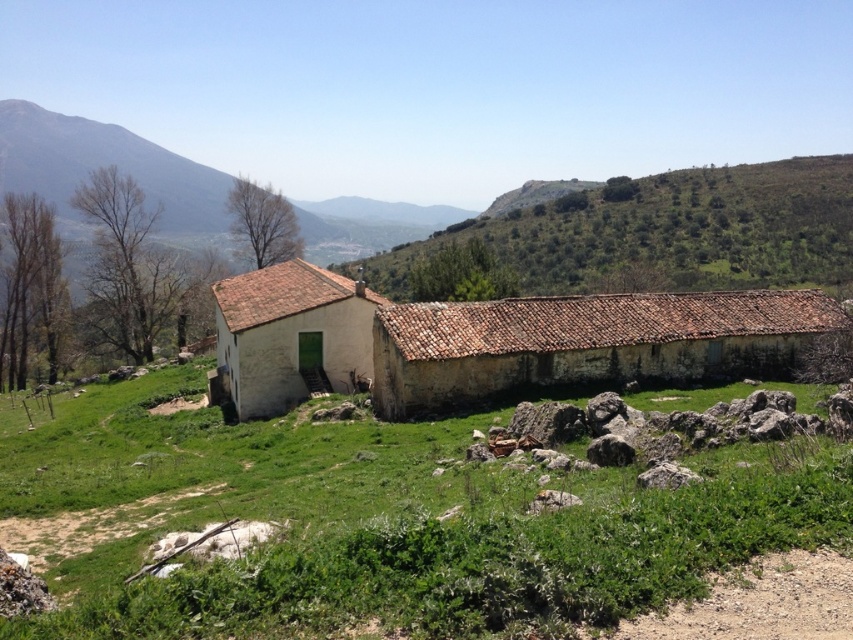
Is white clay barn at center below white matte house at center?

Yes, white clay barn at center is below white matte house at center.

Between white clay barn at center and white matte house at center, which one appears on the right side from the viewer's perspective?

From the viewer's perspective, white clay barn at center appears more on the right side.

Is point (397, 416) more distant than point (312, 339)?

No, it is in front of (312, 339).

Where is `white clay barn at center`? The height and width of the screenshot is (640, 853). white clay barn at center is located at coordinates (489, 339).

Is green grassy at center below white matte house at center?

Yes.

Where is `green grassy at center`? The image size is (853, 640). green grassy at center is located at coordinates (450, 538).

Is point (672, 554) positioned after point (247, 291)?

No, it is not.

Where is `green grassy at center`? green grassy at center is located at coordinates (450, 538).

Can you confirm if green grassy at center is shorter than white clay barn at center?

Indeed, green grassy at center has a lesser height compared to white clay barn at center.

Can you confirm if green grassy at center is thinner than white clay barn at center?

Indeed, green grassy at center has a lesser width compared to white clay barn at center.

This screenshot has height=640, width=853. Describe the element at coordinates (450, 538) in the screenshot. I see `green grassy at center` at that location.

Where is `green grassy at center`? The image size is (853, 640). green grassy at center is located at coordinates (450, 538).